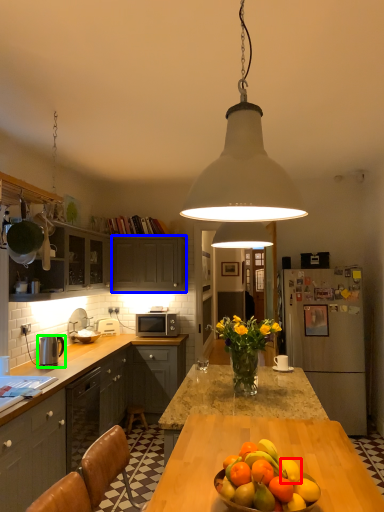
Question: Which object is the farthest from citrus fruit (highlighted by a red box)? Choose among these: cabinetry (highlighted by a blue box) or appliance (highlighted by a green box).

Choices:
 (A) cabinetry
 (B) appliance

Answer: (A)